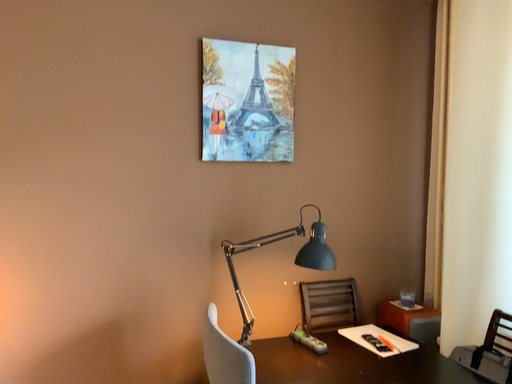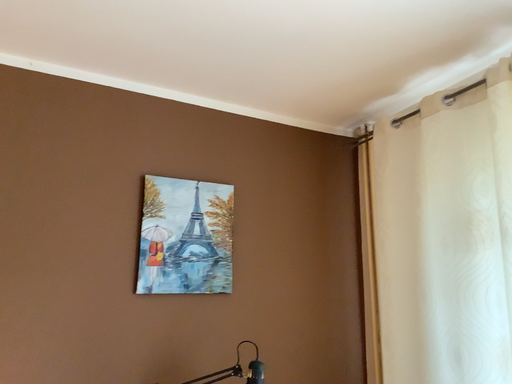
Question: How did the camera likely rotate when shooting the video?

Choices:
 (A) rotated upward
 (B) rotated downward

Answer: (A)